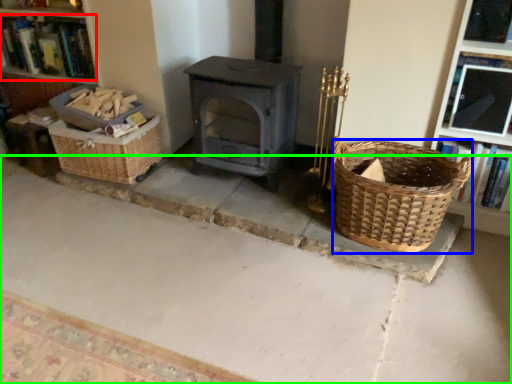
Question: Which object is positioned farthest from book (highlighted by a red box)? Select from basket (highlighted by a blue box) and concrete (highlighted by a green box).

Choices:
 (A) basket
 (B) concrete

Answer: (A)